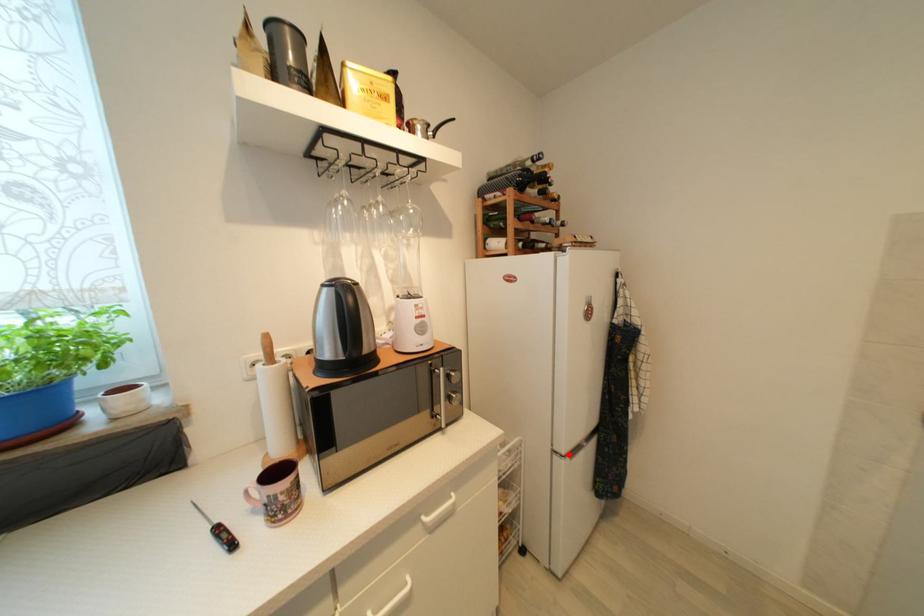
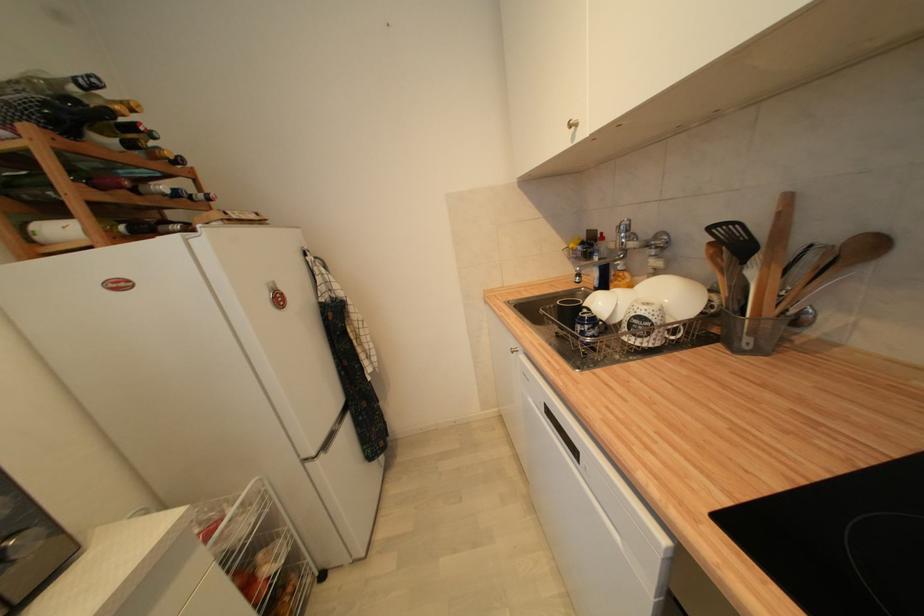
Where in the second image is the point corresponding to the highlighted location from the first image?

(319, 456)